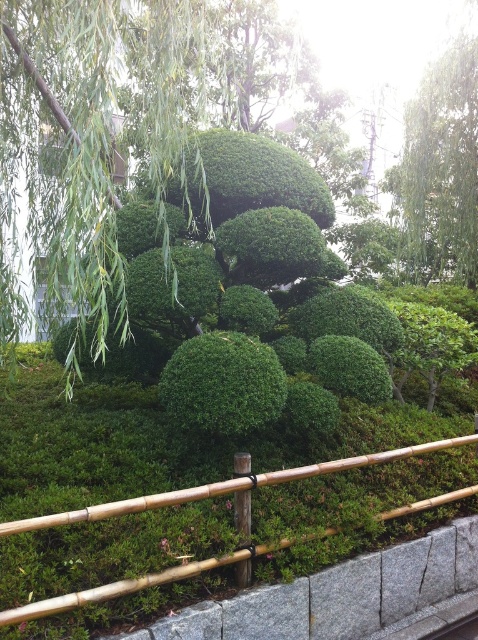
Which of these two, green leafy bush at center or bamboo fence at center, stands taller?

With more height is green leafy bush at center.

Find the location of a particular element. green leafy bush at center is located at coordinates (97, 125).

Does point (8, 252) lie in front of point (351, 564)?

No, (8, 252) is further to viewer.

Can you confirm if green leafy bush at center is taller than gray granite curb at lower center?

Yes.

Describe the element at coordinates (97, 125) in the screenshot. This screenshot has width=478, height=640. I see `green leafy bush at center` at that location.

I want to click on green leafy bush at center, so click(x=97, y=125).

Consider the image. Who is lower down, gray granite curb at lower center or green leafy tree at upper right?

Positioned lower is gray granite curb at lower center.

At what (x,y) coordinates should I click in order to perform the action: click on gray granite curb at lower center. Please return your answer as a coordinate pair (x, y). Image resolution: width=478 pixels, height=640 pixels. Looking at the image, I should click on (337, 595).

What do you see at coordinates (337, 595) in the screenshot? This screenshot has height=640, width=478. I see `gray granite curb at lower center` at bounding box center [337, 595].

I want to click on gray granite curb at lower center, so click(337, 595).